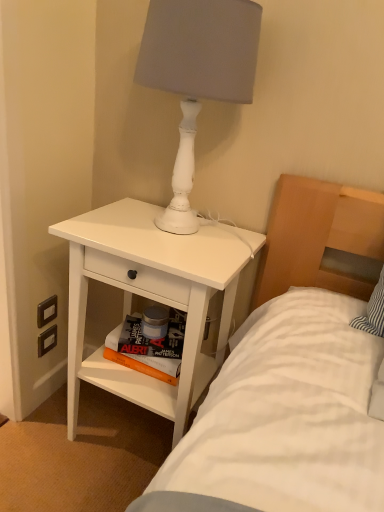
At what (x,y) coordinates should I click in order to perform the action: click on free point above white matte nightstand at lower left (from a real-world perspective). Please return your answer as a coordinate pair (x, y). Looking at the image, I should click on (135, 218).